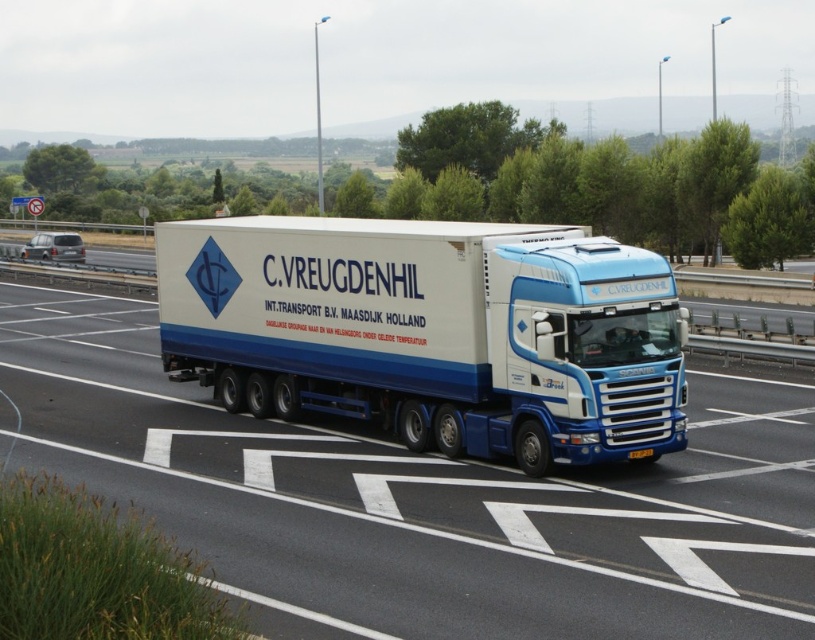
Question: Is white matte truck at center in front of yellow matte license plate at center?

Choices:
 (A) yes
 (B) no

Answer: (A)

Question: Considering the real-world distances, which object is farthest from the blue metallic truck at center?

Choices:
 (A) white matte truck at center
 (B) yellow matte license plate at center

Answer: (B)

Question: Which object is farther from the camera taking this photo?

Choices:
 (A) white matte truck at center
 (B) blue metallic truck at center
 (C) yellow matte license plate at center

Answer: (C)

Question: Does blue metallic truck at center lie behind yellow matte license plate at center?

Choices:
 (A) yes
 (B) no

Answer: (B)

Question: Which point appears closest to the camera in this image?

Choices:
 (A) (465, 380)
 (B) (654, 454)

Answer: (B)

Question: In this image, where is white matte truck at center located relative to blue metallic truck at center?

Choices:
 (A) right
 (B) left

Answer: (B)